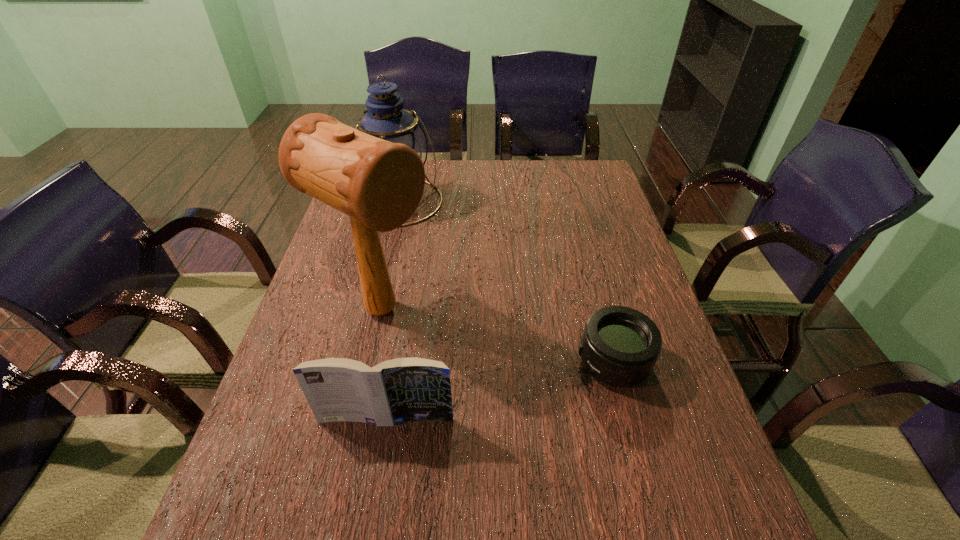
You are a GUI agent. You are given a task and a screenshot of the screen. Output one action in this format:
    pyautogui.click(x=<x>, y=<y>)
    Task: Click on the vacant area that lies between the book and the third shortest object
    
    Given the screenshot: What is the action you would take?
    pyautogui.click(x=393, y=310)

At what (x,y) coordinates should I click in order to perform the action: click on free spot between the lantern and the mallet. Please return your answer as a coordinate pair (x, y). This screenshot has height=540, width=960. Looking at the image, I should click on (391, 256).

Locate an element on the screen. Image resolution: width=960 pixels, height=540 pixels. vacant space that is in between the nearest object and the lantern is located at coordinates (393, 310).

Where is `empty location between the nearest object and the telephoto lens`? empty location between the nearest object and the telephoto lens is located at coordinates (500, 391).

Image resolution: width=960 pixels, height=540 pixels. I want to click on vacant region between the rightmost object and the book, so click(x=500, y=391).

Identify which object is the closest to the third shortest object. Please provide its 2D coordinates. Your answer should be formatted as a tuple, i.e. [(x, y)], where the tuple contains the x and y coordinates of a point satisfying the conditions above.

[(379, 184)]

At what (x,y) coordinates should I click in order to perform the action: click on the second closest object to the nearest object. Please return your answer as a coordinate pair (x, y). This screenshot has width=960, height=540. Looking at the image, I should click on (620, 346).

Where is `vacant point that satisfies the following two spatial constraints: 1. on the front side of the shortest object; 2. on the side of the farthest object with brand markings and control switches`? The width and height of the screenshot is (960, 540). vacant point that satisfies the following two spatial constraints: 1. on the front side of the shortest object; 2. on the side of the farthest object with brand markings and control switches is located at coordinates (360, 362).

Where is `free location that satisfies the following two spatial constraints: 1. on the front side of the mallet; 2. on the right side of the farthest object`? This screenshot has width=960, height=540. free location that satisfies the following two spatial constraints: 1. on the front side of the mallet; 2. on the right side of the farthest object is located at coordinates (372, 310).